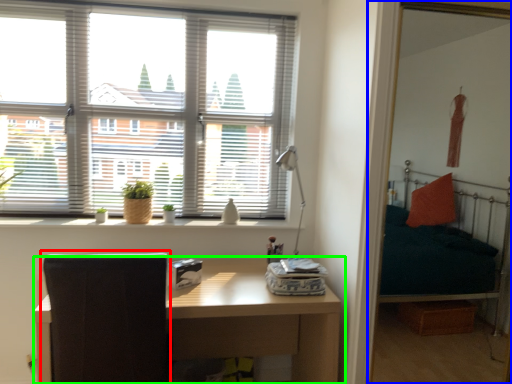
Question: Based on their relative distances, which object is nearer to swivel chair (highlighted by a red box)? Choose from bunk bed (highlighted by a blue box) and table (highlighted by a green box).

Choices:
 (A) bunk bed
 (B) table

Answer: (B)